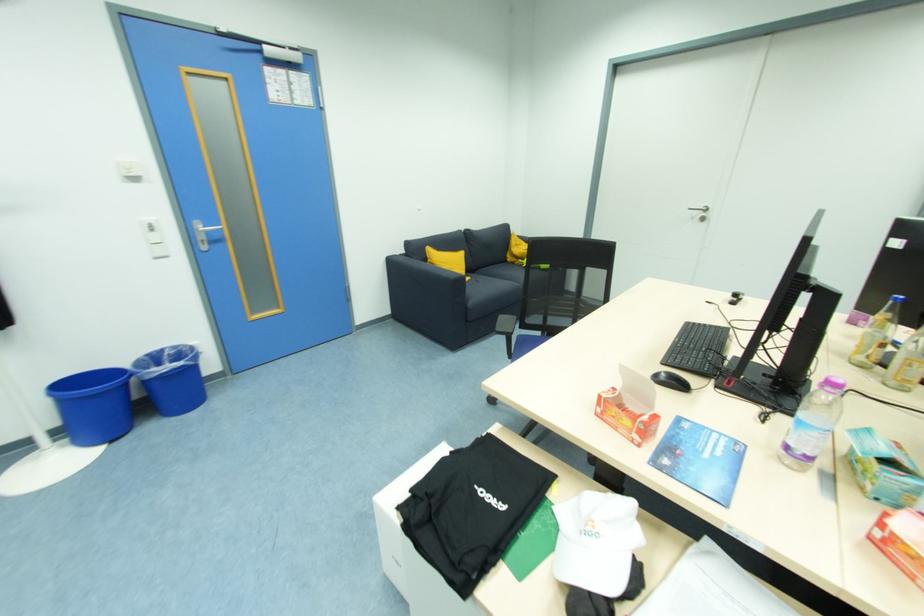
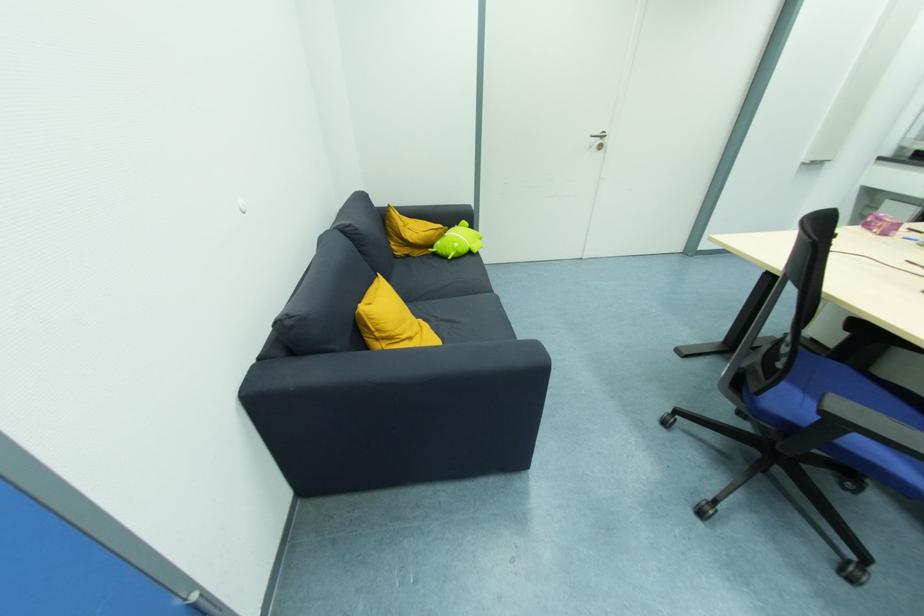
Locate, in the second image, the point that corresponds to point 432,254 in the first image.

(372, 321)